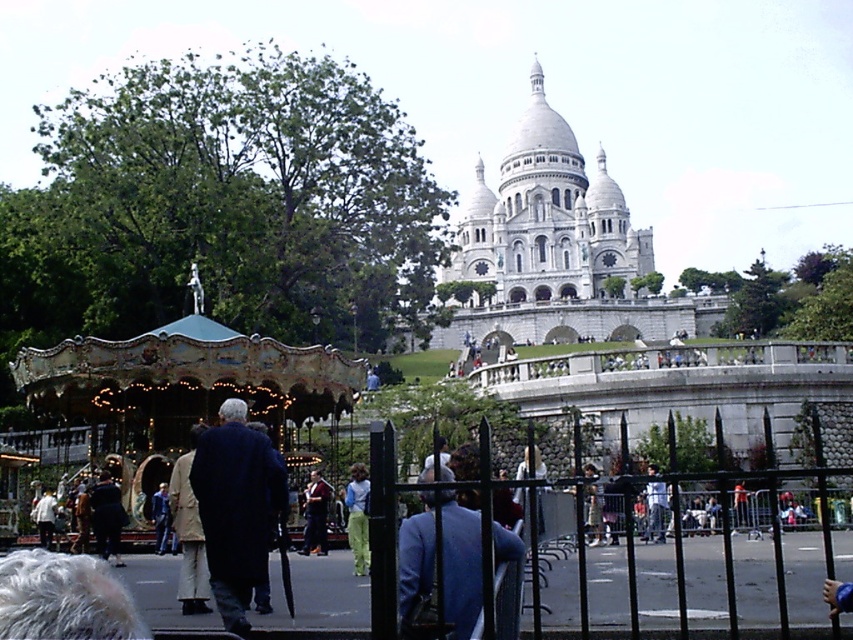
From the picture: You are a photographer standing at the base of the Sacre Coeur Basilica and want to take a photo of a person wearing both the blue fabric jacket at center and dark blue jeans at center. The camera you are using has a maximum focus range of 20 meters. Will you be able to capture both items clearly in the same photo?

The blue fabric jacket at center and dark blue jeans at center are 19.86 meters apart from each other. Since the distance between them is within the camera maximum focus range of 20 meters, you can capture both items clearly in the same photo.

You are standing at the point with coordinates point (321, 548) and want to take a photo of the Basilica of the Sacred Heart. There is an obstacle at point (465, 573). Will the obstacle block your view of the Basilica?

Point (465, 573) is in front of point (321, 548), so the obstacle at point (465, 573) will block your view of the Basilica of the Sacred Heart.

You are standing at the point marked as point (357, 516) in the Montmartre scene. What object is located exactly at that point?

The green textured pants at center are located exactly at point (357, 516).